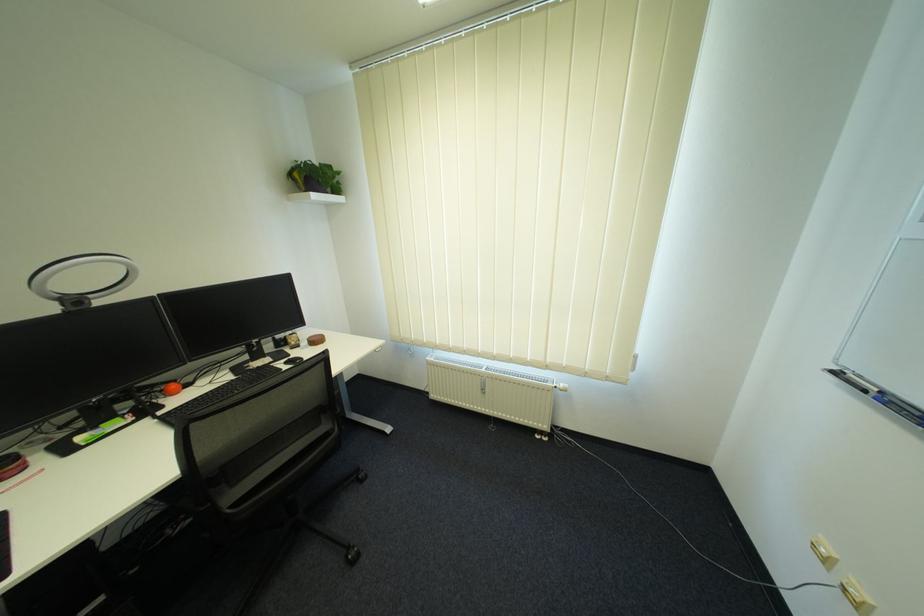
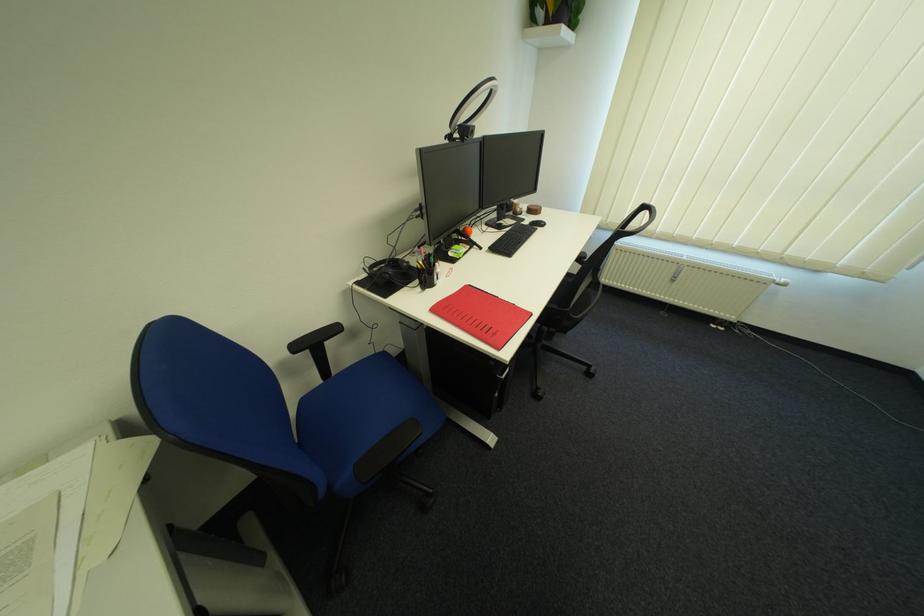
Question: In a continuous first-person perspective shot, in which direction is the camera moving?

Choices:
 (A) Left
 (B) Right
 (C) Forward
 (D) Backward

Answer: (A)